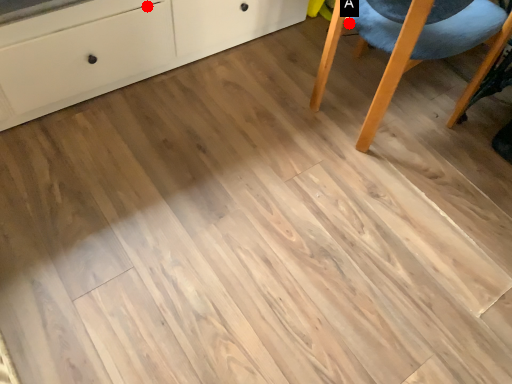
Question: Two points are circled on the image, labeled by A and B beside each circle. Which point is farther from the camera taking this photo?

Choices:
 (A) A is further
 (B) B is further

Answer: (A)